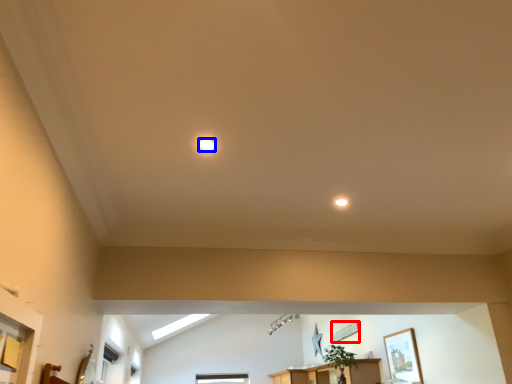
Question: Which object appears farthest to the camera in this image, picture frame (highlighted by a red box) or lighting (highlighted by a blue box)?

Choices:
 (A) picture frame
 (B) lighting

Answer: (A)